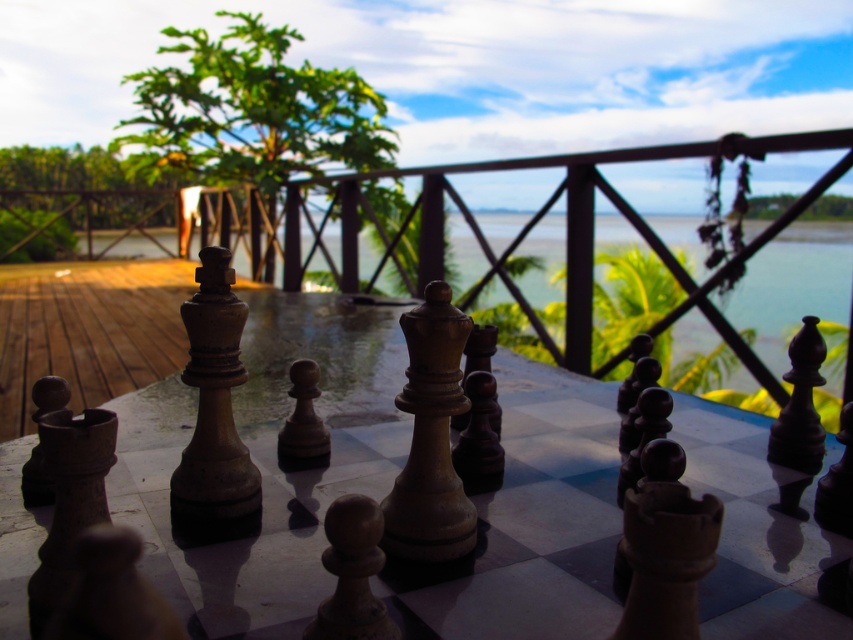
Is wooden chessboard at center below transparent glass water at center?

Indeed, wooden chessboard at center is positioned under transparent glass water at center.

Does point (233, 602) lie in front of point (680, 333)?

Yes.

Where is `wooden chessboard at center`? wooden chessboard at center is located at coordinates (265, 464).